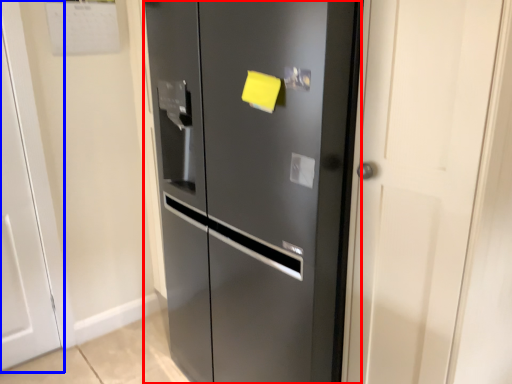
Question: Which of the following is the farthest to the observer, door (highlighted by a red box) or door (highlighted by a blue box)?

Choices:
 (A) door
 (B) door

Answer: (B)